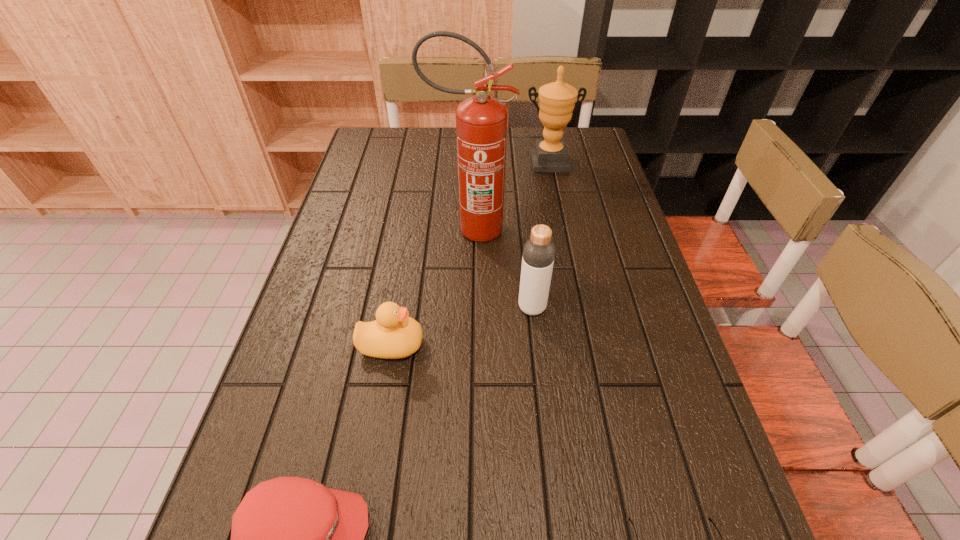
At what (x,y) coordinates should I click in order to perform the action: click on fire extinguisher. Please return your answer as a coordinate pair (x, y). Looking at the image, I should click on (481, 121).

Locate an element on the screen. The height and width of the screenshot is (540, 960). the tallest object is located at coordinates (481, 121).

Locate an element on the screen. The width and height of the screenshot is (960, 540). the fifth shortest object is located at coordinates (557, 100).

Identify the location of award. (557, 100).

Image resolution: width=960 pixels, height=540 pixels. I want to click on bottle, so click(x=538, y=256).

At what (x,y) coordinates should I click in order to perform the action: click on the fourth nearest object. Please return your answer as a coordinate pair (x, y). Looking at the image, I should click on (538, 256).

At what (x,y) coordinates should I click in order to perform the action: click on duck. Please return your answer as a coordinate pair (x, y). The width and height of the screenshot is (960, 540). Looking at the image, I should click on (393, 335).

Locate an element on the screen. This screenshot has width=960, height=540. the fourth farthest object is located at coordinates (393, 335).

Where is `vacant space situated 0.090m from the nozzle of the second farthest object`? vacant space situated 0.090m from the nozzle of the second farthest object is located at coordinates (543, 230).

You are a GUI agent. You are given a task and a screenshot of the screen. Output one action in this format:
    pyautogui.click(x=<x>, y=<y>)
    Task: Click on the vacant space located at the front of the award with handles
    Image resolution: width=960 pixels, height=540 pixels.
    Given the screenshot: What is the action you would take?
    coord(556,198)